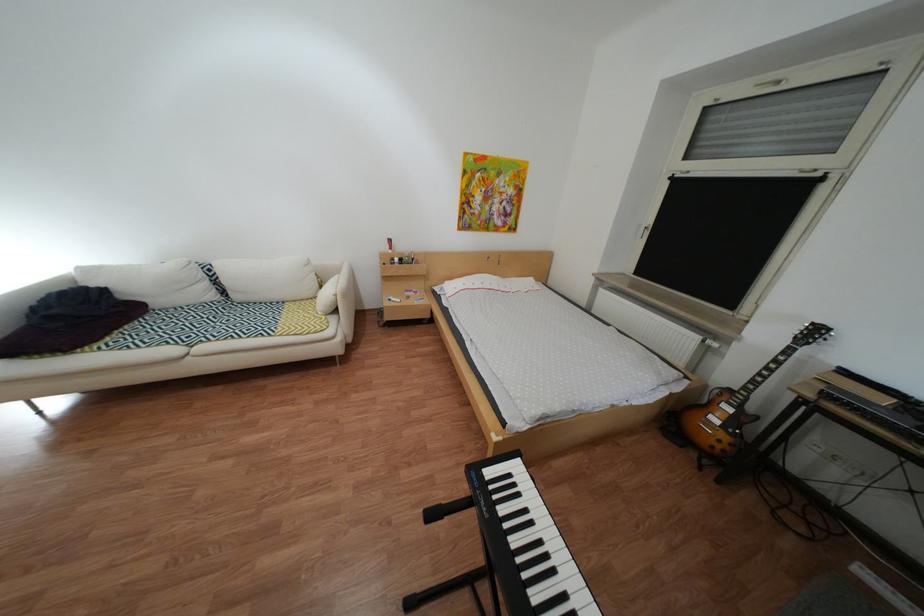
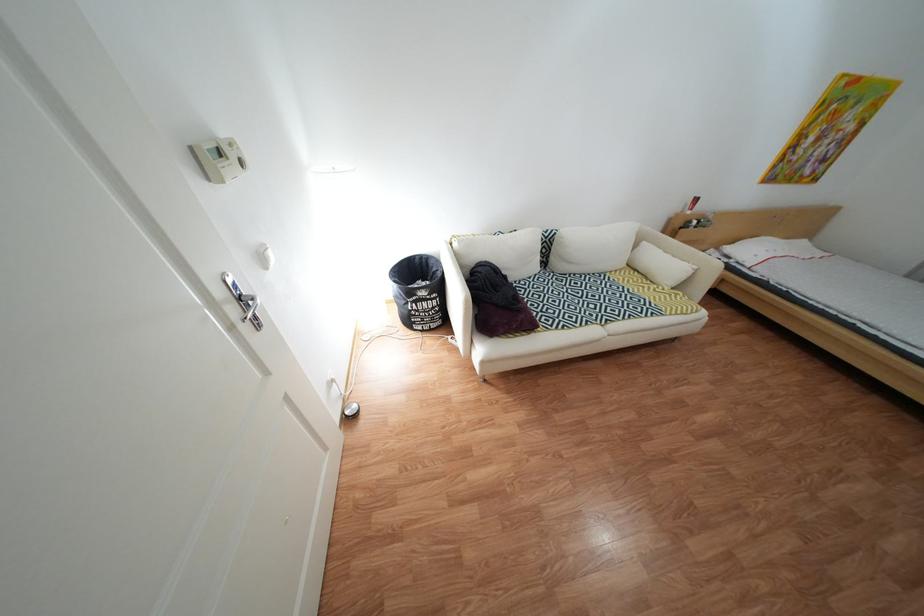
Where in the second image is the point corresponding to [165,308] from the first image?

(525, 281)